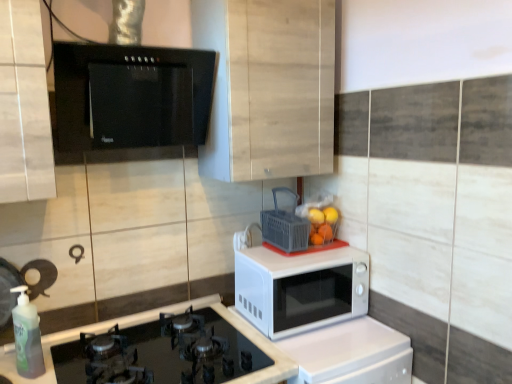
Question: Considering the relative sizes of black glass gas stove at lower left and white glossy microwave at center in the image provided, is black glass gas stove at lower left shorter than white glossy microwave at center?

Choices:
 (A) no
 (B) yes

Answer: (B)

Question: Considering the relative sizes of black glass gas stove at lower left and white glossy microwave at center in the image provided, is black glass gas stove at lower left smaller than white glossy microwave at center?

Choices:
 (A) no
 (B) yes

Answer: (B)

Question: Can you confirm if black glass gas stove at lower left is thinner than white glossy microwave at center?

Choices:
 (A) no
 (B) yes

Answer: (B)

Question: Is black glass gas stove at lower left surrounding white glossy microwave at center?

Choices:
 (A) yes
 (B) no

Answer: (B)

Question: Is black glass gas stove at lower left further to camera compared to white glossy microwave at center?

Choices:
 (A) no
 (B) yes

Answer: (A)

Question: Is there a large distance between black glass gas stove at lower left and white glossy microwave at center?

Choices:
 (A) no
 (B) yes

Answer: (A)

Question: Does orange matte at upper right, the 1th orange in the right-to-left sequence, have a greater height compared to white glossy microwave at center?

Choices:
 (A) yes
 (B) no

Answer: (B)

Question: Is orange matte at upper right, the 1th orange in the right-to-left sequence, oriented towards white glossy microwave at center?

Choices:
 (A) yes
 (B) no

Answer: (B)

Question: From the image's perspective, is orange matte at upper right, the 1th orange in the right-to-left sequence, beneath white glossy microwave at center?

Choices:
 (A) no
 (B) yes

Answer: (A)

Question: Can you confirm if orange matte at upper right, which ranks as the 2th orange in left-to-right order, is smaller than white glossy microwave at center?

Choices:
 (A) yes
 (B) no

Answer: (A)

Question: Is orange matte at upper right, which ranks as the 2th orange in left-to-right order, wider than white glossy microwave at center?

Choices:
 (A) no
 (B) yes

Answer: (A)

Question: From the image's perspective, is orange matte at upper right, the 1th orange in the right-to-left sequence, on top of white glossy microwave at center?

Choices:
 (A) no
 (B) yes

Answer: (B)

Question: Is orange matte at upper right, the 1th orange in the right-to-left sequence, shorter than green translucent bottle at lower left?

Choices:
 (A) no
 (B) yes

Answer: (B)